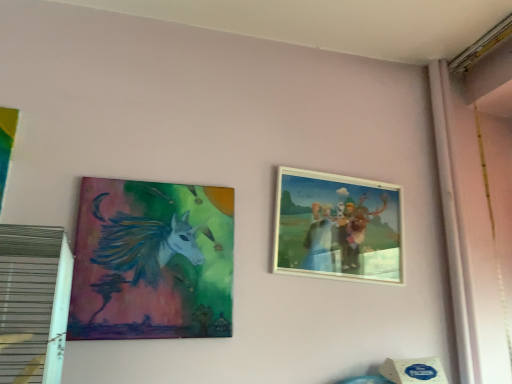
What do you see at coordinates (152, 261) in the screenshot?
I see `matte acrylic painting of unicorn at left, which appears as the second picture frame when viewed from the right` at bounding box center [152, 261].

What is the approximate width of matte acrylic painting of unicorn at left, which appears as the second picture frame when viewed from the right?

matte acrylic painting of unicorn at left, which appears as the second picture frame when viewed from the right, is 1.20 inches in width.

Locate an element on the screen. The width and height of the screenshot is (512, 384). matte acrylic painting of unicorn at left, the 1th picture frame viewed from the left is located at coordinates (152, 261).

What do you see at coordinates (337, 227) in the screenshot? I see `wooden picture frame at upper right, arranged as the second picture frame when viewed from the left` at bounding box center [337, 227].

Find the location of a particular element. The image size is (512, 384). wooden picture frame at upper right, arranged as the second picture frame when viewed from the left is located at coordinates (337, 227).

What are the coordinates of `matte acrylic painting of unicorn at left, which appears as the second picture frame when viewed from the right` in the screenshot? It's located at (152, 261).

Which object is positioned more to the left, wooden picture frame at upper right, the first picture frame positioned from the right, or matte acrylic painting of unicorn at left, the 1th picture frame viewed from the left?

From the viewer's perspective, matte acrylic painting of unicorn at left, the 1th picture frame viewed from the left, appears more on the left side.

Does wooden picture frame at upper right, the first picture frame positioned from the right, come in front of matte acrylic painting of unicorn at left, which appears as the second picture frame when viewed from the right?

No, wooden picture frame at upper right, the first picture frame positioned from the right, is behind matte acrylic painting of unicorn at left, which appears as the second picture frame when viewed from the right.

Does point (341, 214) come in front of point (209, 320)?

No, (341, 214) is behind (209, 320).

From the image's perspective, is wooden picture frame at upper right, the first picture frame positioned from the right, positioned above or below matte acrylic painting of unicorn at left, the 1th picture frame viewed from the left?

wooden picture frame at upper right, the first picture frame positioned from the right, is situated higher than matte acrylic painting of unicorn at left, the 1th picture frame viewed from the left, in the image.

From a real-world perspective, is wooden picture frame at upper right, arranged as the second picture frame when viewed from the left, positioned over matte acrylic painting of unicorn at left, the 1th picture frame viewed from the left, based on gravity?

Correct, in the physical world, wooden picture frame at upper right, arranged as the second picture frame when viewed from the left, is higher than matte acrylic painting of unicorn at left, the 1th picture frame viewed from the left.

Based on the photo, between wooden picture frame at upper right, arranged as the second picture frame when viewed from the left, and matte acrylic painting of unicorn at left, the 1th picture frame viewed from the left, which one has smaller width?

matte acrylic painting of unicorn at left, the 1th picture frame viewed from the left, is thinner.

Considering the relative sizes of wooden picture frame at upper right, arranged as the second picture frame when viewed from the left, and matte acrylic painting of unicorn at left, the 1th picture frame viewed from the left, in the image provided, is wooden picture frame at upper right, arranged as the second picture frame when viewed from the left, shorter than matte acrylic painting of unicorn at left, the 1th picture frame viewed from the left,?

Correct, wooden picture frame at upper right, arranged as the second picture frame when viewed from the left, is not as tall as matte acrylic painting of unicorn at left, the 1th picture frame viewed from the left.

Which of these two, wooden picture frame at upper right, arranged as the second picture frame when viewed from the left, or matte acrylic painting of unicorn at left, which appears as the second picture frame when viewed from the right, is smaller?

With smaller size is matte acrylic painting of unicorn at left, which appears as the second picture frame when viewed from the right.

Would you say wooden picture frame at upper right, arranged as the second picture frame when viewed from the left, is inside or outside matte acrylic painting of unicorn at left, the 1th picture frame viewed from the left?

wooden picture frame at upper right, arranged as the second picture frame when viewed from the left, is located beyond the bounds of matte acrylic painting of unicorn at left, the 1th picture frame viewed from the left.

Is wooden picture frame at upper right, arranged as the second picture frame when viewed from the left, with matte acrylic painting of unicorn at left, the 1th picture frame viewed from the left?

There is a gap between wooden picture frame at upper right, arranged as the second picture frame when viewed from the left, and matte acrylic painting of unicorn at left, the 1th picture frame viewed from the left.

From the picture: Is wooden picture frame at upper right, the first picture frame positioned from the right, oriented towards matte acrylic painting of unicorn at left, the 1th picture frame viewed from the left?

No, wooden picture frame at upper right, the first picture frame positioned from the right, is not oriented towards matte acrylic painting of unicorn at left, the 1th picture frame viewed from the left.

What's the angular difference between wooden picture frame at upper right, arranged as the second picture frame when viewed from the left, and matte acrylic painting of unicorn at left, which appears as the second picture frame when viewed from the right,'s facing directions?

0.00478 degrees separate the facing orientations of wooden picture frame at upper right, arranged as the second picture frame when viewed from the left, and matte acrylic painting of unicorn at left, which appears as the second picture frame when viewed from the right.

At what (x,y) coordinates should I click in order to perform the action: click on picture frame that is below the wooden picture frame at upper right, arranged as the second picture frame when viewed from the left (from the image's perspective). Please return your answer as a coordinate pair (x, y). The height and width of the screenshot is (384, 512). Looking at the image, I should click on (152, 261).

Is matte acrylic painting of unicorn at left, the 1th picture frame viewed from the left, to the left of wooden picture frame at upper right, arranged as the second picture frame when viewed from the left, from the viewer's perspective?

Indeed, matte acrylic painting of unicorn at left, the 1th picture frame viewed from the left, is positioned on the left side of wooden picture frame at upper right, arranged as the second picture frame when viewed from the left.

Which object is further away from the camera taking this photo, matte acrylic painting of unicorn at left, which appears as the second picture frame when viewed from the right, or wooden picture frame at upper right, arranged as the second picture frame when viewed from the left?

wooden picture frame at upper right, arranged as the second picture frame when viewed from the left.

Which is closer to the camera, (185, 249) or (336, 205)?

The point (185, 249) is closer.

From the image's perspective, is matte acrylic painting of unicorn at left, the 1th picture frame viewed from the left, on wooden picture frame at upper right, the first picture frame positioned from the right?

No, from the image's perspective, matte acrylic painting of unicorn at left, the 1th picture frame viewed from the left, is not above wooden picture frame at upper right, the first picture frame positioned from the right.

From a real-world perspective, is matte acrylic painting of unicorn at left, the 1th picture frame viewed from the left, under wooden picture frame at upper right, arranged as the second picture frame when viewed from the left?

Correct, in the physical world, matte acrylic painting of unicorn at left, the 1th picture frame viewed from the left, is lower than wooden picture frame at upper right, arranged as the second picture frame when viewed from the left.

Can you confirm if matte acrylic painting of unicorn at left, which appears as the second picture frame when viewed from the right, is wider than wooden picture frame at upper right, arranged as the second picture frame when viewed from the left?

In fact, matte acrylic painting of unicorn at left, which appears as the second picture frame when viewed from the right, might be narrower than wooden picture frame at upper right, arranged as the second picture frame when viewed from the left.

Considering the relative sizes of matte acrylic painting of unicorn at left, the 1th picture frame viewed from the left, and wooden picture frame at upper right, arranged as the second picture frame when viewed from the left, in the image provided, is matte acrylic painting of unicorn at left, the 1th picture frame viewed from the left, taller than wooden picture frame at upper right, arranged as the second picture frame when viewed from the left,?

Correct, matte acrylic painting of unicorn at left, the 1th picture frame viewed from the left, is much taller as wooden picture frame at upper right, arranged as the second picture frame when viewed from the left.

Consider the image. Considering the relative sizes of matte acrylic painting of unicorn at left, the 1th picture frame viewed from the left, and wooden picture frame at upper right, the first picture frame positioned from the right, in the image provided, is matte acrylic painting of unicorn at left, the 1th picture frame viewed from the left, bigger than wooden picture frame at upper right, the first picture frame positioned from the right,?

Incorrect, matte acrylic painting of unicorn at left, the 1th picture frame viewed from the left, is not larger than wooden picture frame at upper right, the first picture frame positioned from the right.

Is matte acrylic painting of unicorn at left, which appears as the second picture frame when viewed from the right, situated inside wooden picture frame at upper right, arranged as the second picture frame when viewed from the left, or outside?

matte acrylic painting of unicorn at left, which appears as the second picture frame when viewed from the right, lies outside wooden picture frame at upper right, arranged as the second picture frame when viewed from the left.

Is matte acrylic painting of unicorn at left, which appears as the second picture frame when viewed from the right, not close to wooden picture frame at upper right, arranged as the second picture frame when viewed from the left?

No, matte acrylic painting of unicorn at left, which appears as the second picture frame when viewed from the right, is in close proximity to wooden picture frame at upper right, arranged as the second picture frame when viewed from the left.

Is matte acrylic painting of unicorn at left, which appears as the second picture frame when viewed from the right, oriented away from wooden picture frame at upper right, the first picture frame positioned from the right?

matte acrylic painting of unicorn at left, which appears as the second picture frame when viewed from the right, does not have its back to wooden picture frame at upper right, the first picture frame positioned from the right.

What's the angular difference between matte acrylic painting of unicorn at left, which appears as the second picture frame when viewed from the right, and wooden picture frame at upper right, arranged as the second picture frame when viewed from the left,'s facing directions?

There is a 0.00478-degree angle between the facing directions of matte acrylic painting of unicorn at left, which appears as the second picture frame when viewed from the right, and wooden picture frame at upper right, arranged as the second picture frame when viewed from the left.

In the scene shown: Measure the distance between matte acrylic painting of unicorn at left, which appears as the second picture frame when viewed from the right, and wooden picture frame at upper right, arranged as the second picture frame when viewed from the left.

matte acrylic painting of unicorn at left, which appears as the second picture frame when viewed from the right, and wooden picture frame at upper right, arranged as the second picture frame when viewed from the left, are 13.49 inches apart.

The image size is (512, 384). In order to click on picture frame that is on the right side of matte acrylic painting of unicorn at left, which appears as the second picture frame when viewed from the right in this screenshot , I will do `click(337, 227)`.

The height and width of the screenshot is (384, 512). Find the location of `picture frame located above the matte acrylic painting of unicorn at left, which appears as the second picture frame when viewed from the right (from a real-world perspective)`. picture frame located above the matte acrylic painting of unicorn at left, which appears as the second picture frame when viewed from the right (from a real-world perspective) is located at coordinates (337, 227).

In the image, there is a wooden picture frame at upper right, arranged as the second picture frame when viewed from the left. Where is `picture frame below it (from the image's perspective)`? The image size is (512, 384). picture frame below it (from the image's perspective) is located at coordinates (152, 261).